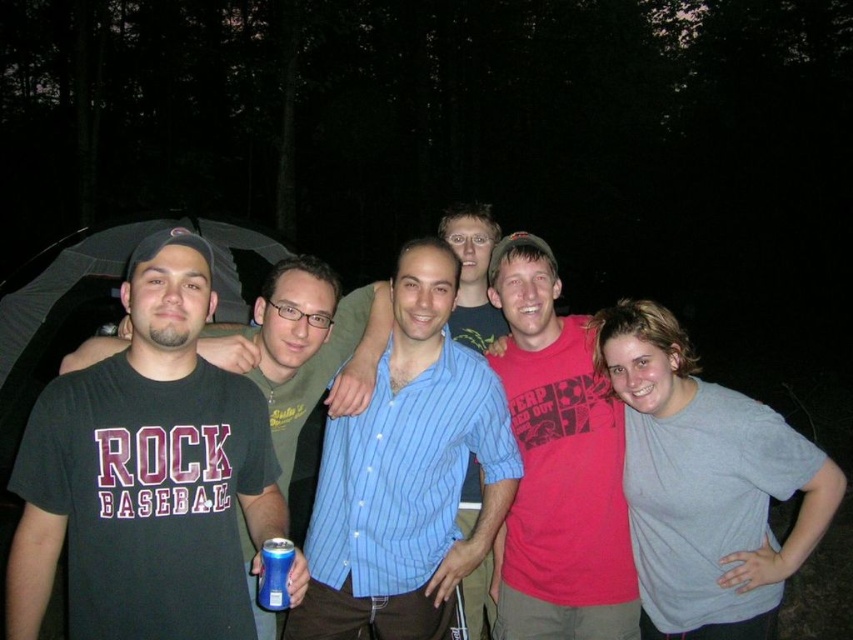
Looking at this image, you are organizing a clothing drive and need to determine which of the two shirts, the blue striped shirt at center or the matte red shirt at center, can fit into a donation box that requires items to be no larger than the size of the blue striped shirt. Based on the image, which shirt would qualify?

The blue striped shirt at center is smaller than the matte red shirt at center, so the blue striped shirt at center qualifies for the donation box since it meets the size requirement.

What object is located at the coordinates point (x=407, y=474) in the image?

The point (x=407, y=474) is on the blue striped shirt at center.